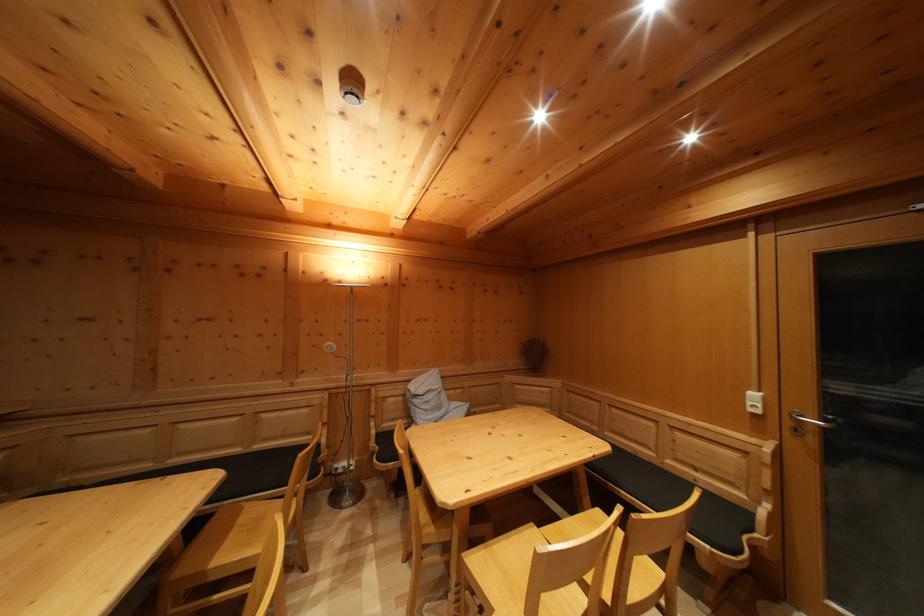
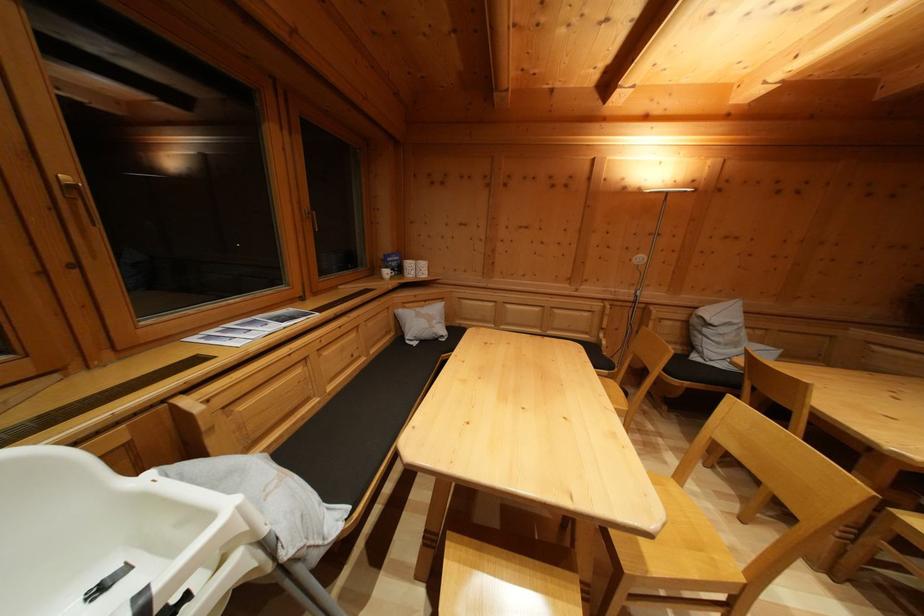
Where in the second image is the point corresponding to point 420,408 from the first image?

(711, 337)